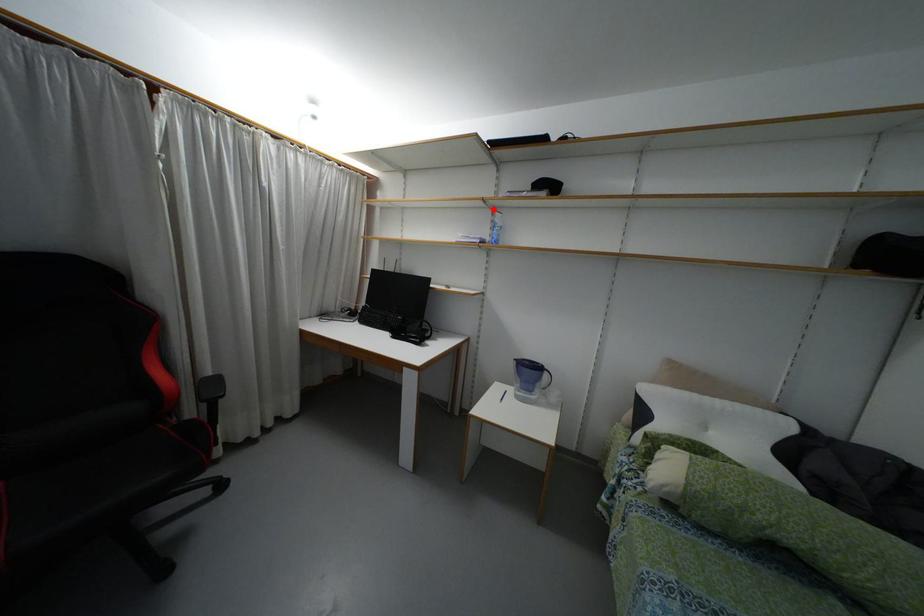
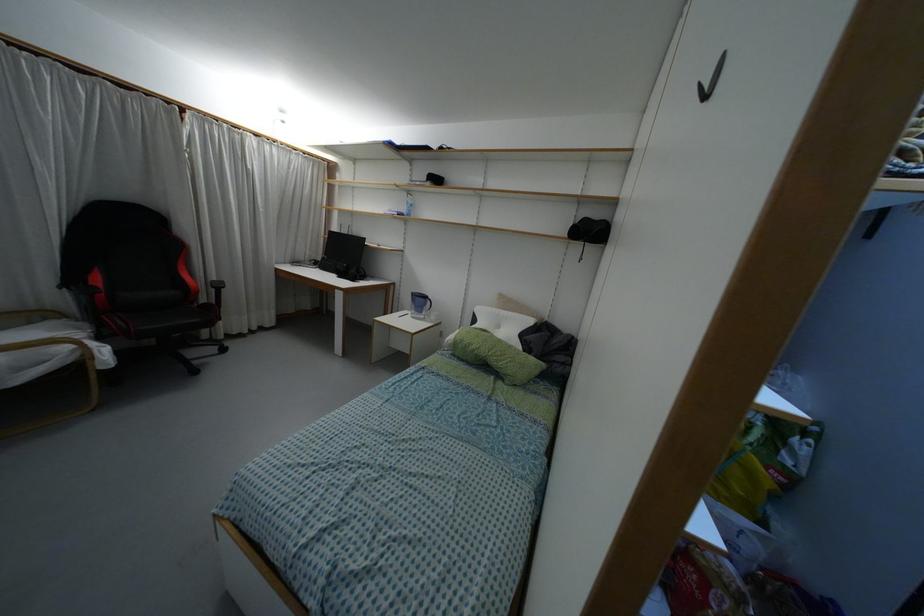
Where in the second image is the point corresponding to the highlighted location from the first image?

(407, 192)